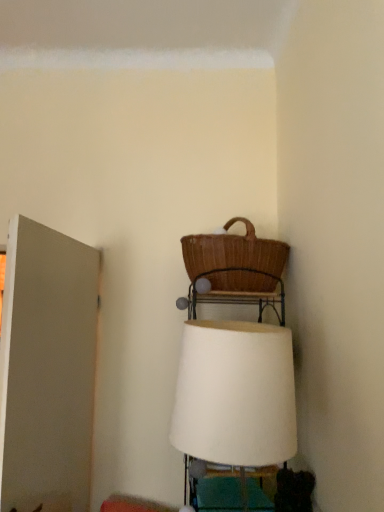
Question: Relative to brown wicker picnic basket at upper center, is white fabric lampshade at center in front or behind?

Choices:
 (A) front
 (B) behind

Answer: (A)

Question: Is white fabric lampshade at center taller or shorter than brown wicker picnic basket at upper center?

Choices:
 (A) tall
 (B) short

Answer: (A)

Question: Based on their relative distances, which object is nearer to the white matte door at left?

Choices:
 (A) white fabric lampshade at center
 (B) brown wicker picnic basket at upper center

Answer: (B)

Question: Considering the real-world distances, which object is farthest from the brown wicker picnic basket at upper center?

Choices:
 (A) white fabric lampshade at center
 (B) white matte door at left

Answer: (B)